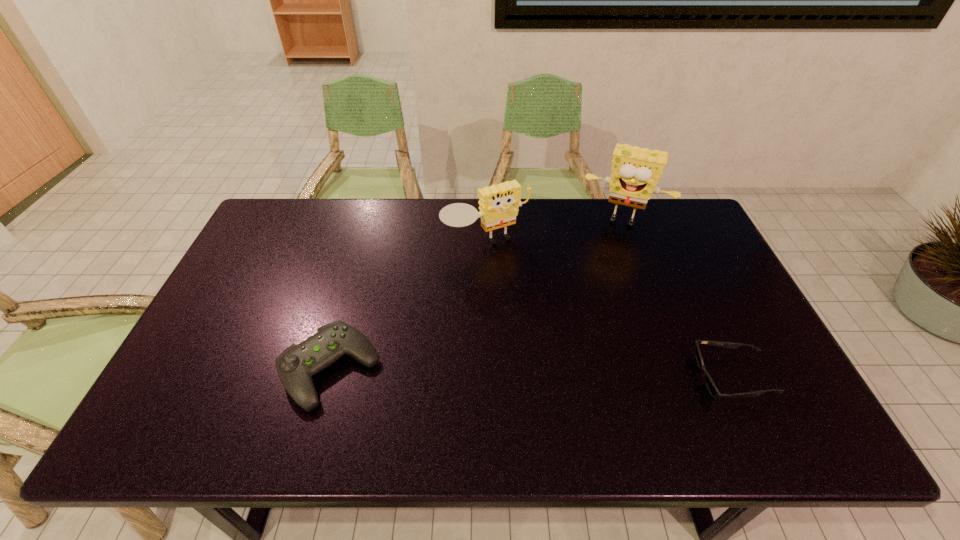
Identify the location of vacant space that is in between the shortest object and the leftmost object. (531, 373).

You are a GUI agent. You are given a task and a screenshot of the screen. Output one action in this format:
    pyautogui.click(x=<x>, y=<y>)
    Task: Click on the vacant space in between the left sponge and the right sponge
    The image size is (960, 540).
    Given the screenshot: What is the action you would take?
    pyautogui.click(x=554, y=232)

Image resolution: width=960 pixels, height=540 pixels. Identify the location of free space between the second shortest object and the tallest object. (476, 295).

This screenshot has width=960, height=540. I want to click on free area in between the third object from right to left and the sunglasses, so click(x=609, y=310).

The image size is (960, 540). Identify the location of blank region between the control and the right sponge. (476, 295).

At what (x,y) coordinates should I click in order to perform the action: click on free space between the sunglasses and the third object from right to left. Please return your answer as a coordinate pair (x, y). The image size is (960, 540). Looking at the image, I should click on (609, 310).

Locate an element on the screen. unoccupied area between the taller sponge and the control is located at coordinates (476, 295).

Image resolution: width=960 pixels, height=540 pixels. Identify the location of vacant point located between the shortest object and the leftmost object. (531, 373).

The height and width of the screenshot is (540, 960). I want to click on free area in between the control and the tallest object, so click(x=476, y=295).

The height and width of the screenshot is (540, 960). I want to click on the second closest object to the tallest object, so click(711, 386).